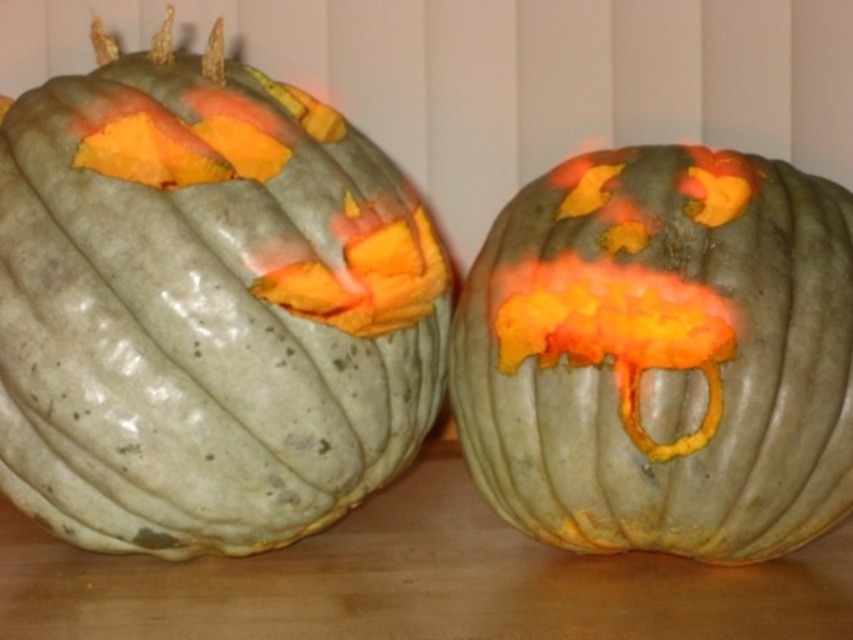
You are organizing a pumpkin display and need to place the matte green pumpkin at left and the matte gray pumpkin at center on a shelf. The shelf has limited space, and you want to ensure they fit side by side. Which pumpkin should you place first to maximize space efficiency?

The matte green pumpkin at left is wider than the matte gray pumpkin at center. To maximize space efficiency, place the wider matte green pumpkin at left first, then the narrower matte gray pumpkin at center next to it.

You are arranging pumpkins on a table and need to place a new pumpkin between the matte green pumpkin at left and the matte gray pumpkin at center. Where should you place the new pumpkin to maintain the current left to right order?

Place the new pumpkin between the matte green pumpkin at left and the matte gray pumpkin at center, ensuring it is to the right of the matte green pumpkin at left and to the left of the matte gray pumpkin at center, maintaining their left to right order.